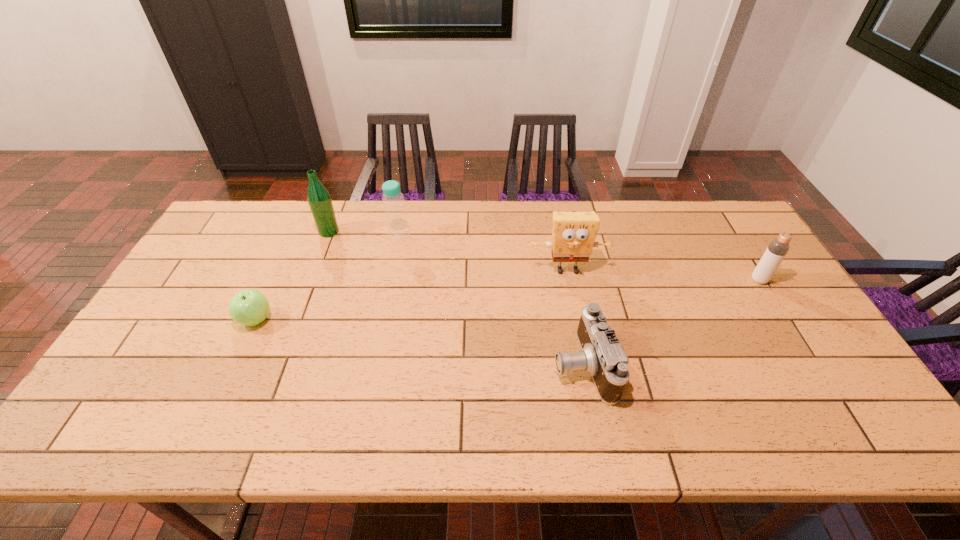
What are the coordinates of `the second object from left to right` in the screenshot? It's located at coord(319,200).

At what (x,y) coordinates should I click in order to perform the action: click on the second bottle from left to right. Please return your answer as a coordinate pair (x, y). Looking at the image, I should click on (398, 231).

Identify the location of sponge. Image resolution: width=960 pixels, height=540 pixels. (573, 234).

I want to click on the shortest bottle, so click(776, 251).

Locate an element on the screen. The width and height of the screenshot is (960, 540). the nearest bottle is located at coordinates (776, 251).

Locate an element on the screen. Image resolution: width=960 pixels, height=540 pixels. the second shortest object is located at coordinates (602, 356).

This screenshot has height=540, width=960. I want to click on the shortest object, so click(249, 307).

The image size is (960, 540). I want to click on the leftmost object, so click(x=249, y=307).

Identify the location of vacant space situated 0.100m on the front of the fifth object from right to left. (319, 259).

This screenshot has height=540, width=960. I want to click on vacant space located 0.170m on the front of the fourth object from right to left, so click(390, 282).